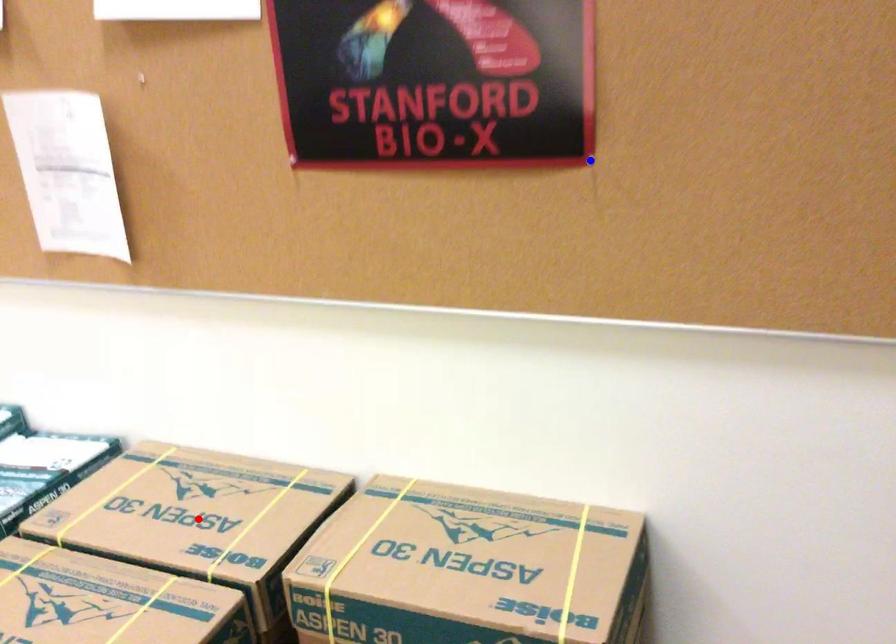
Question: Two points are marked on the image. Which point is closer to the camera?

Choices:
 (A) Blue point is closer.
 (B) Red point is closer.

Answer: (A)